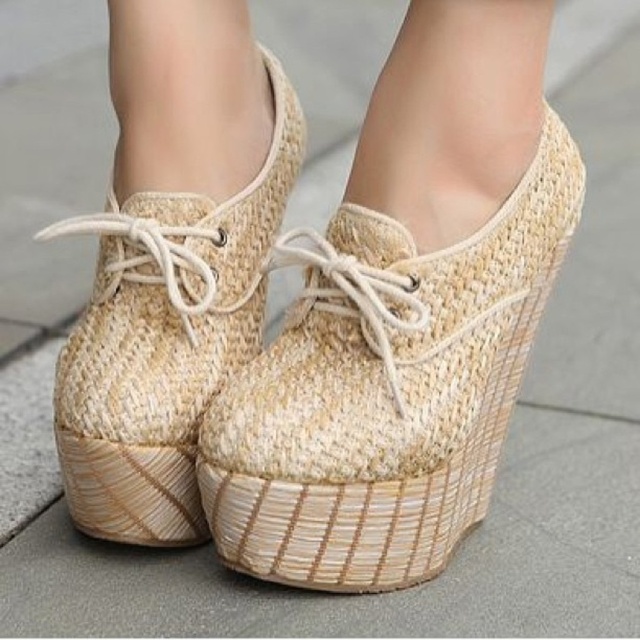
You are taking a photo of the platform wedge shoes and notice two points marked on the image. The first point is at coordinate point (500, 404) and the second is at point (61, 444). Which point is closer to the camera?

Point (500, 404) is further to the camera than point (61, 444), so the second point is closer to the camera.

You are trying to decide which shoe to wear for a casual walk. Both the natural woven shoe at center and the woven beige shoe at center are options. Which one has a bigger size?

The natural woven shoe at center has a larger size compared to the woven beige shoe at center, so it is bigger in size.